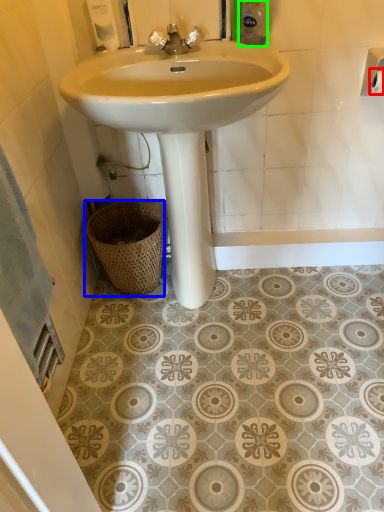
Question: Based on their relative distances, which object is nearer to toilet paper (highlighted by a red box)? Choose from basket (highlighted by a blue box) and toiletry (highlighted by a green box).

Choices:
 (A) basket
 (B) toiletry

Answer: (B)